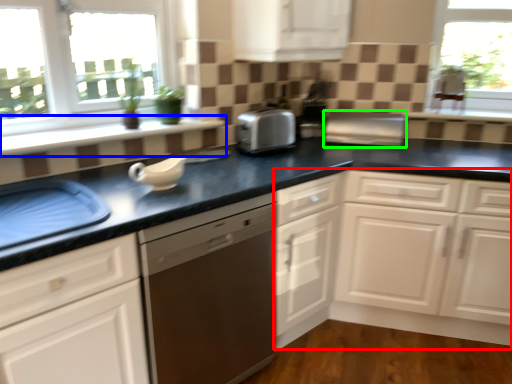
Question: Based on their relative distances, which object is nearer to cabinetry (highlighted by a red box)? Choose from window sill (highlighted by a blue box) and appliance (highlighted by a green box).

Choices:
 (A) window sill
 (B) appliance

Answer: (B)